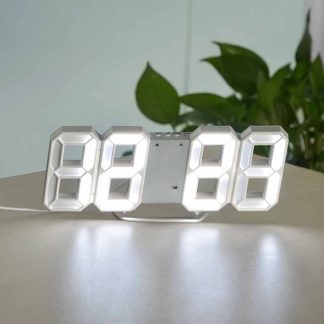
The image size is (324, 324). In order to click on plant in this screenshot , I will do `click(283, 87)`.